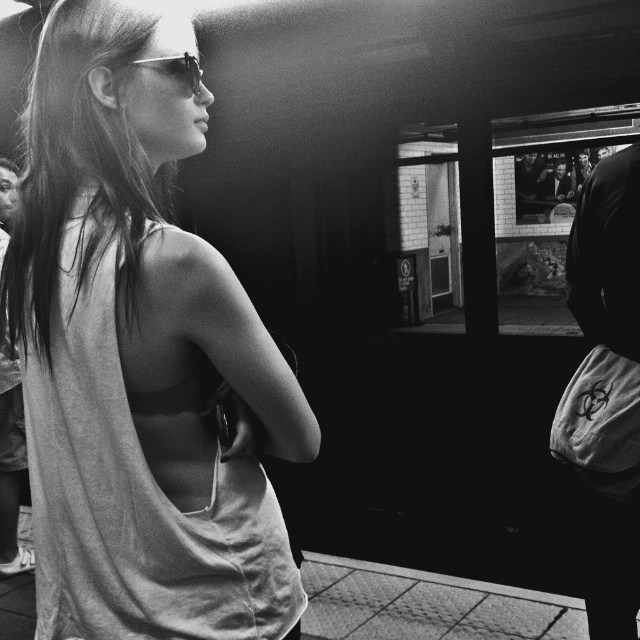
Between matte white tank top at center and shiny metallic sunglasses at center, which one is positioned higher?

shiny metallic sunglasses at center is higher up.

Is matte white tank top at center smaller than shiny metallic sunglasses at center?

No.

Between point (147, 224) and point (152, 61), which one is positioned behind?

Point (152, 61)

Where is `matte white tank top at center`? matte white tank top at center is located at coordinates (140, 355).